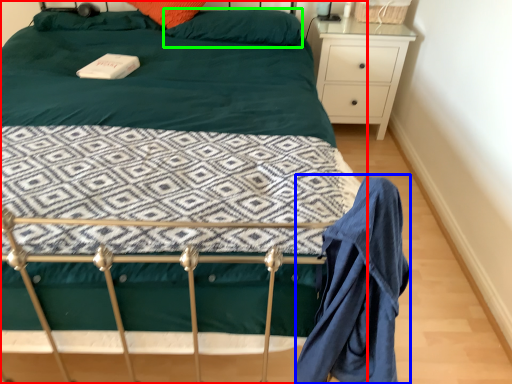
Question: Which is farther away from bed (highlighted by a red box)? robe (highlighted by a blue box) or pillow (highlighted by a green box)?

Choices:
 (A) robe
 (B) pillow

Answer: (B)